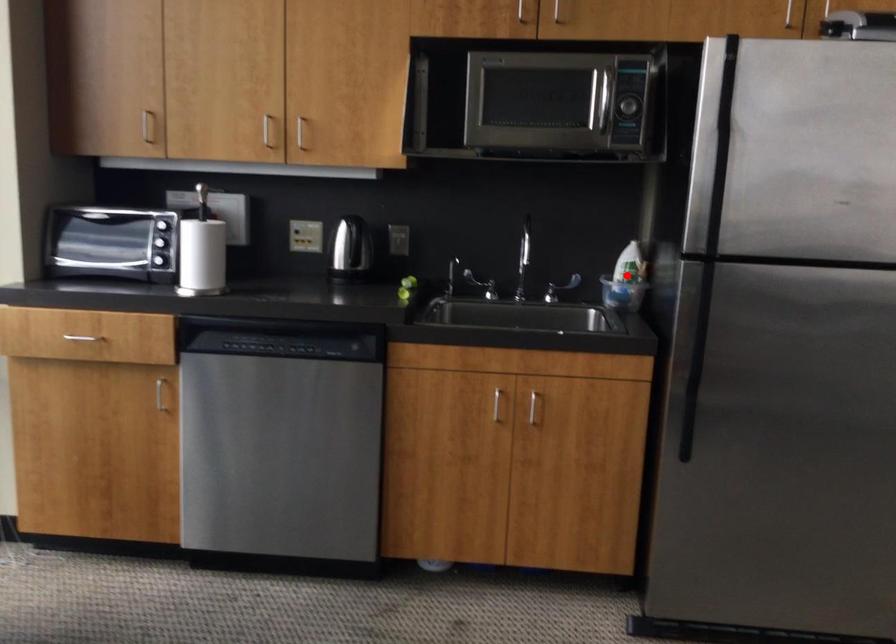
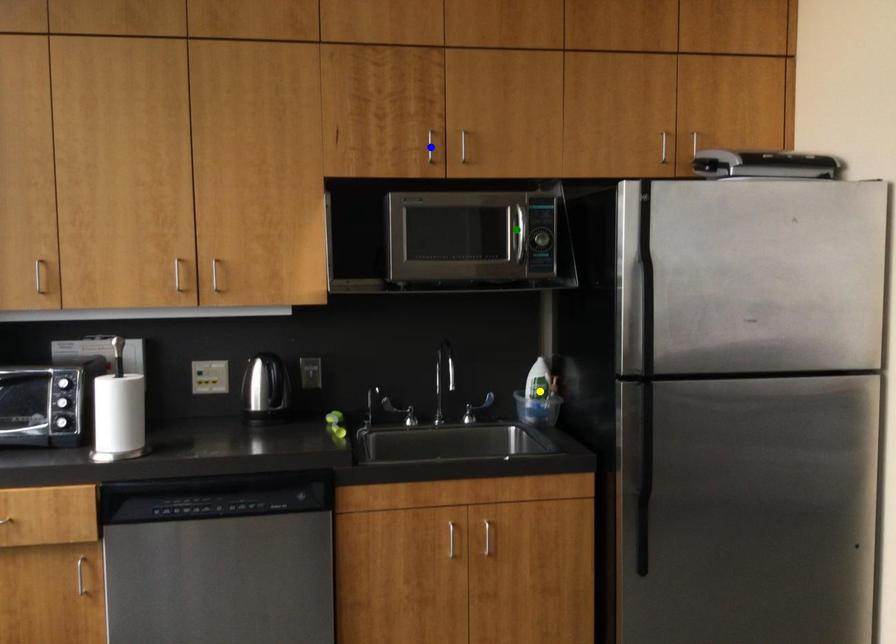
Question: I am providing you with two images of the same scene from different viewpoints. A red point is marked on the first image. You are given multiple points on the second image. Which point in image 2 is actually the same real-world point as the red point in image 1?

Choices:
 (A) green point
 (B) yellow point
 (C) blue point

Answer: (B)